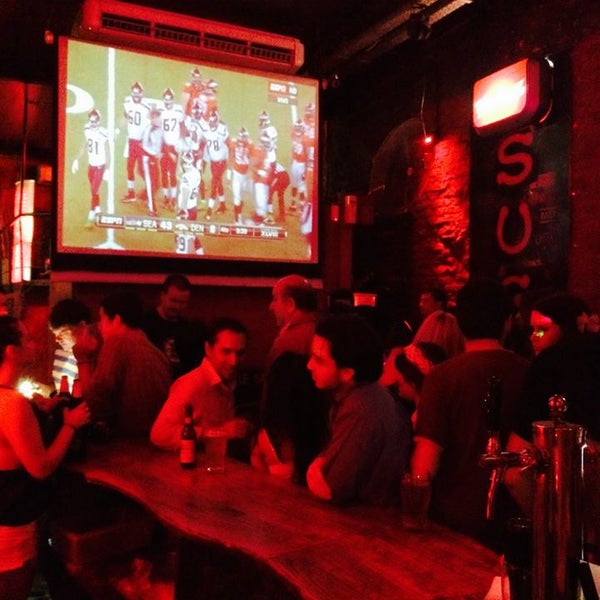
The width and height of the screenshot is (600, 600). I want to click on television, so click(x=164, y=176).